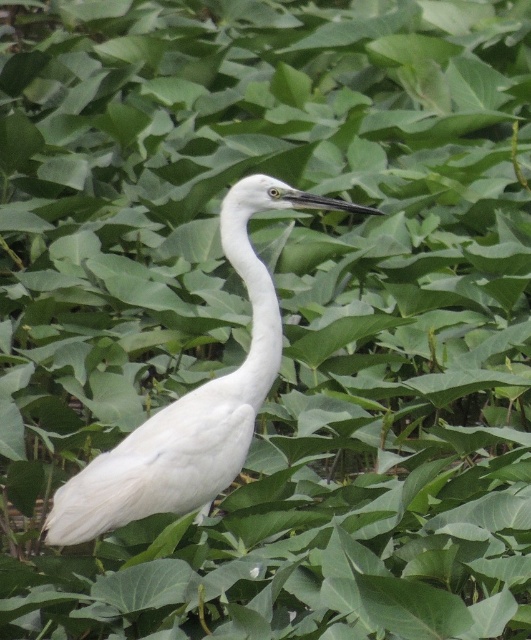
From the picture: You are a nature photographer trying to capture a clear shot of the white feathered bird at center and the white smooth neck at center. Which object should you focus on to ensure it appears larger in your photo?

The white feathered bird at center is much taller than the white smooth neck at center, so focusing on the white feathered bird at center will make it appear larger in the photo.

You are a photographer trying to capture the white bird in the center. The bird is at point (x=192, y=403). You need to adjust your camera to focus on the bird. What is the exact location of the bird?

The bird is located at point (x=192, y=403).

You are a nature photographer aiming to capture the white feathered bird at center and the white smooth neck at center in a single frame. Based on their sizes, which one will occupy more space in your photo?

The white feathered bird at center is larger in width than the white smooth neck at center, so it will occupy more space in the photo.